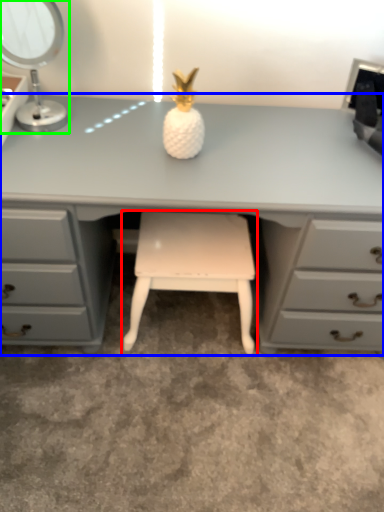
Question: Considering the real-world distances, which object is farthest from stool (highlighted by a red box)? desk (highlighted by a blue box) or table lamp (highlighted by a green box)?

Choices:
 (A) desk
 (B) table lamp

Answer: (B)